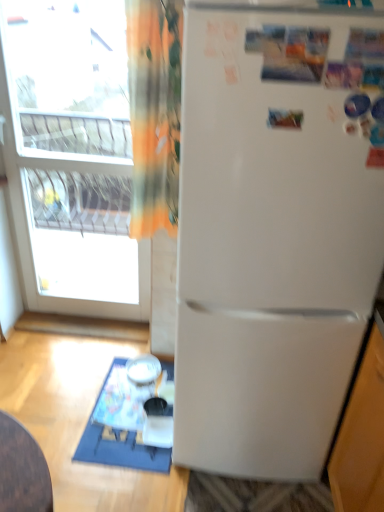
Identify the location of vacant space to the left of white plastic table at lower left. (55, 387).